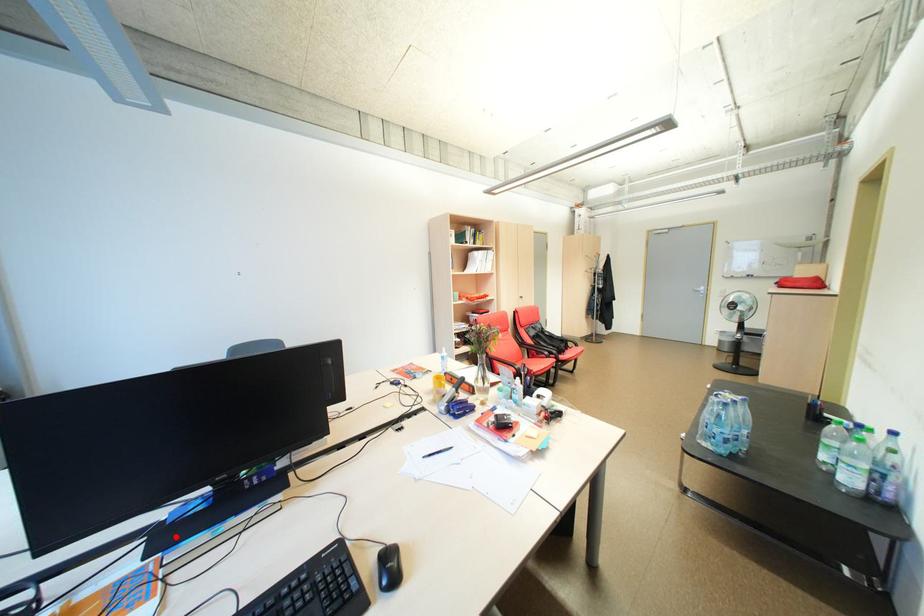
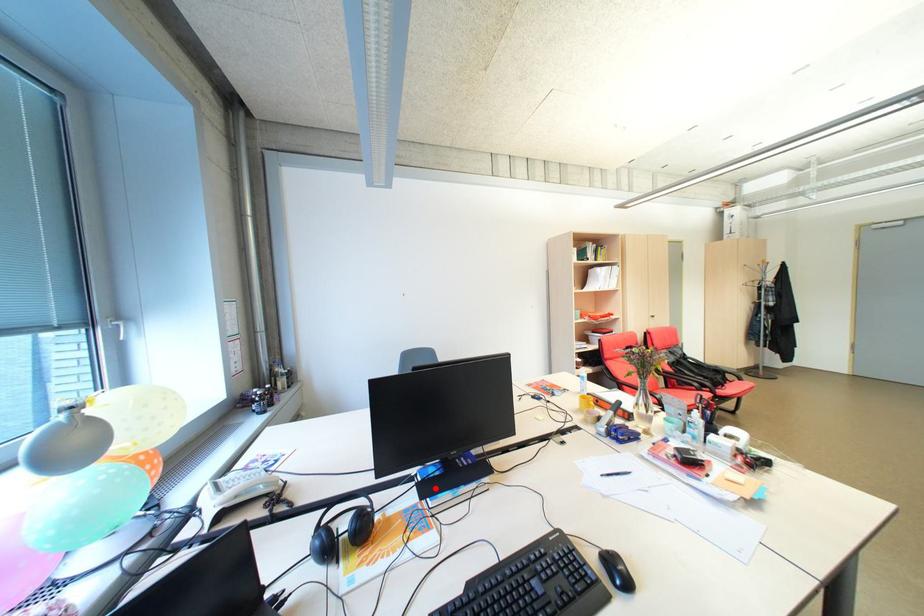
I am providing you with two images of the same scene from different viewpoints. A red point is marked on the first image and another point is marked on the second image. Do the highlighted points in image1 and image2 indicate the same real-world spot?

Yes